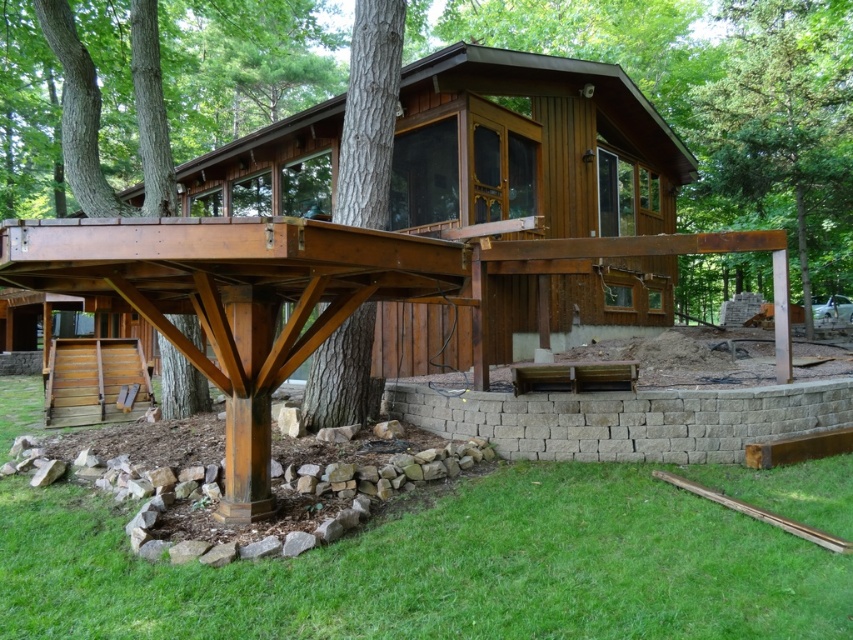
Between brown stone wall at lower center and gray concrete retaining wall at lower center, which one appears on the right side from the viewer's perspective?

Positioned to the right is gray concrete retaining wall at lower center.

Is brown stone wall at lower center further to the viewer compared to gray concrete retaining wall at lower center?

No, brown stone wall at lower center is closer to the viewer.

Which is behind, point (45, 547) or point (722, 445)?

Positioned behind is point (722, 445).

Where is `brown stone wall at lower center`? The image size is (853, 640). brown stone wall at lower center is located at coordinates (439, 568).

What do you see at coordinates (780, 132) in the screenshot? I see `green leafy tree at upper center` at bounding box center [780, 132].

Does green leafy tree at upper center have a larger size compared to gray concrete retaining wall at lower center?

Correct, green leafy tree at upper center is larger in size than gray concrete retaining wall at lower center.

Between point (737, 269) and point (540, 433), which one is positioned in front?

Positioned in front is point (540, 433).

This screenshot has width=853, height=640. In order to click on green leafy tree at upper center in this screenshot , I will do `click(780, 132)`.

Locate an element on the screen. The width and height of the screenshot is (853, 640). brown wooden cabin at center is located at coordinates (531, 147).

Does point (561, 314) lie in front of point (395, 42)?

No, (561, 314) is further to viewer.

The image size is (853, 640). What are the coordinates of `brown wooden cabin at center` in the screenshot? It's located at (531, 147).

This screenshot has height=640, width=853. What are the coordinates of `brown wooden cabin at center` in the screenshot? It's located at (531, 147).